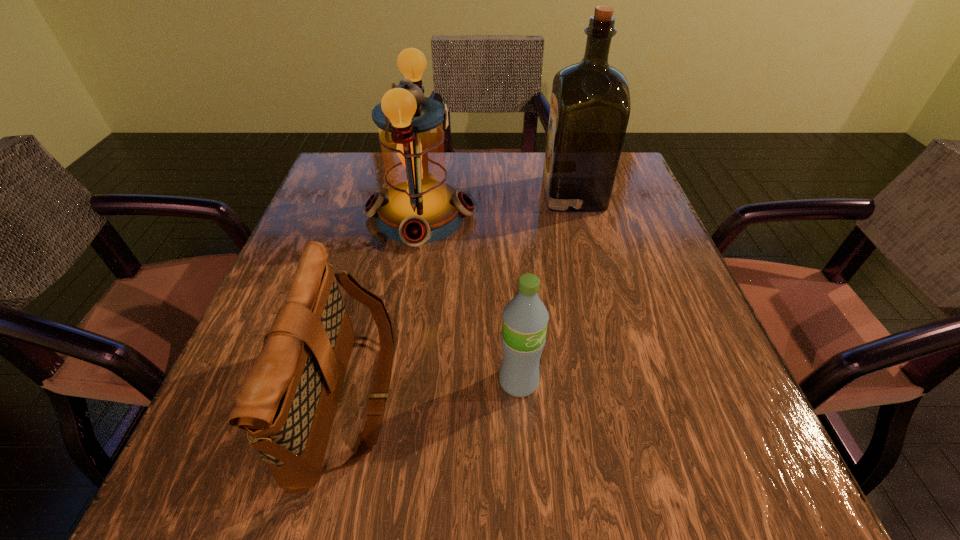
Identify the location of free space that satisfies the following two spatial constraints: 1. on the front-facing side of the lantern; 2. on the back side of the third object from left to right. This screenshot has width=960, height=540. (394, 382).